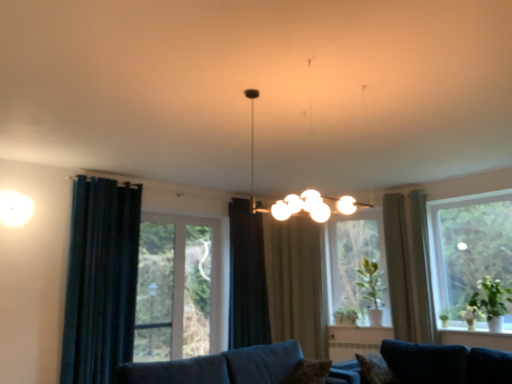
Question: Does green leafy plant at right, the 3th plant when ordered from left to right, have a lesser width compared to green leafy plant at lower center, which ranks as the first plant in back-to-front order?

Choices:
 (A) no
 (B) yes

Answer: (A)

Question: Is green leafy plant at right, positioned as the third plant in back-to-front order, far away from green leafy plant at lower center, which ranks as the first plant in back-to-front order?

Choices:
 (A) yes
 (B) no

Answer: (A)

Question: Is green leafy plant at right, marked as the first plant in a right-to-left arrangement, smaller than green leafy plant at lower center, which ranks as the first plant in back-to-front order?

Choices:
 (A) no
 (B) yes

Answer: (A)

Question: Is green leafy plant at lower center, which ranks as the first plant in back-to-front order, surrounded by green leafy plant at right, marked as the first plant in a right-to-left arrangement?

Choices:
 (A) yes
 (B) no

Answer: (B)

Question: From the image's perspective, is green leafy plant at right, arranged as the first plant when viewed from the front, below green leafy plant at lower center, placed as the third plant when sorted from right to left?

Choices:
 (A) no
 (B) yes

Answer: (A)

Question: Is dark blue fabric curtain at left, which appears as the first curtain when viewed from the left, in front of or behind silky beige curtain at right, which appears as the 2th curtain when viewed from the right, in the image?

Choices:
 (A) front
 (B) behind

Answer: (A)

Question: Would you say dark blue fabric curtain at left, which appears as the first curtain when viewed from the left, is to the left or to the right of silky beige curtain at right, arranged as the fourth curtain when viewed from the left, in the picture?

Choices:
 (A) right
 (B) left

Answer: (B)

Question: Considering the positions of dark blue fabric curtain at left, acting as the fifth curtain starting from the right, and silky beige curtain at right, which appears as the 2th curtain when viewed from the right, in the image, is dark blue fabric curtain at left, acting as the fifth curtain starting from the right, wider or thinner than silky beige curtain at right, which appears as the 2th curtain when viewed from the right,?

Choices:
 (A) wide
 (B) thin

Answer: (B)

Question: Do you think dark blue fabric curtain at left, which appears as the first curtain when viewed from the left, is within silky beige curtain at right, arranged as the fourth curtain when viewed from the left, or outside of it?

Choices:
 (A) outside
 (B) inside

Answer: (A)

Question: Is dark blue fabric curtain at left, acting as the fifth curtain starting from the right, in front of or behind brown textured pillow at lower center, which appears as the 1th pillow when viewed from the left, in the image?

Choices:
 (A) front
 (B) behind

Answer: (B)

Question: In terms of width, does dark blue fabric curtain at left, which appears as the first curtain when viewed from the left, look wider or thinner when compared to brown textured pillow at lower center, which appears as the 1th pillow when viewed from the left?

Choices:
 (A) thin
 (B) wide

Answer: (A)

Question: In terms of height, does dark blue fabric curtain at left, acting as the fifth curtain starting from the right, look taller or shorter compared to brown textured pillow at lower center, which is the 2th pillow from right to left?

Choices:
 (A) short
 (B) tall

Answer: (B)

Question: Is dark blue fabric curtain at left, acting as the fifth curtain starting from the right, bigger or smaller than brown textured pillow at lower center, which is the 2th pillow from right to left?

Choices:
 (A) big
 (B) small

Answer: (A)

Question: From a real-world perspective, relative to brown textured pillow at lower right, arranged as the 1th pillow when viewed from the right, is beige fabric curtain at center, which is the 3th curtain from right to left, vertically above or below?

Choices:
 (A) below
 (B) above

Answer: (B)

Question: Is beige fabric curtain at center, which is the 3th curtain from right to left, in front of or behind brown textured pillow at lower right, arranged as the 1th pillow when viewed from the right, in the image?

Choices:
 (A) behind
 (B) front

Answer: (A)